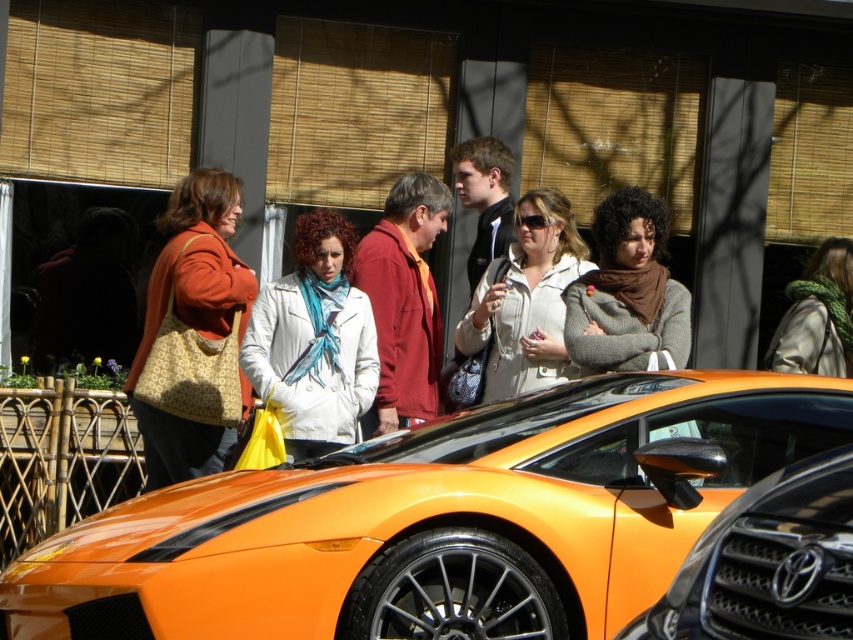
Question: Considering the real-world distances, which object is farthest from the matte brown coat at center?

Choices:
 (A) matte black jacket at center
 (B) brown wool sweater at center
 (C) matte red jacket at center

Answer: (B)

Question: Which point is closer to the camera?

Choices:
 (A) (753, 416)
 (B) (367, 282)

Answer: (A)

Question: Among these points, which one is farthest from the camera?

Choices:
 (A) coord(90,273)
 (B) coord(567,308)
 (C) coord(416,250)
 (D) coord(456,157)

Answer: (A)

Question: Is the position of green knitted scarf at upper right more distant than that of matte black jacket at center?

Choices:
 (A) yes
 (B) no

Answer: (B)

Question: Is matte orange coat at left wider than brown wool sweater at center?

Choices:
 (A) yes
 (B) no

Answer: (A)

Question: Where is brown wool sweater at center located in relation to white textured coat at center in the image?

Choices:
 (A) below
 (B) above

Answer: (B)